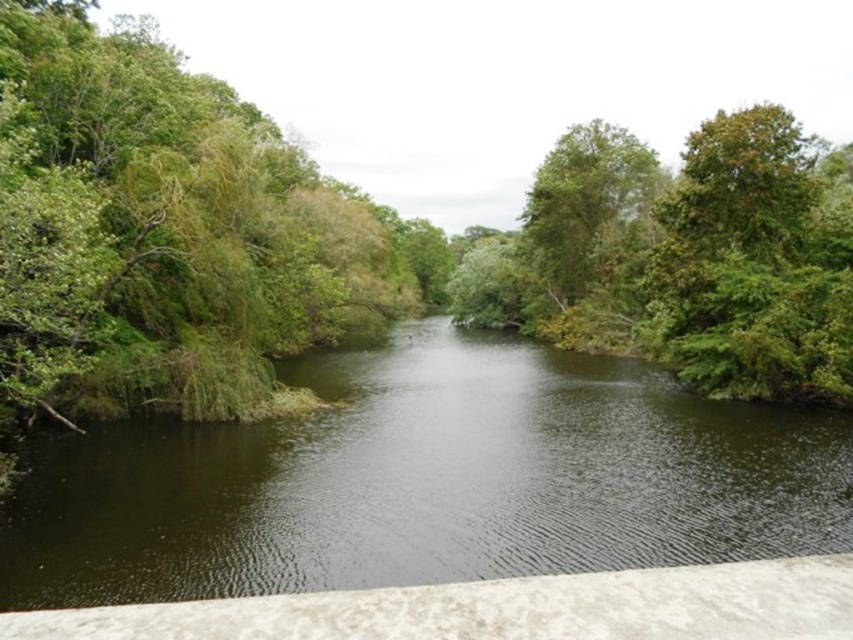
Between point (480, 540) and point (618, 269), which one is positioned behind?

Positioned behind is point (618, 269).

Who is more distant from viewer, (770, 468) or (531, 189)?

Positioned behind is point (531, 189).

Find the location of a particular element. The height and width of the screenshot is (640, 853). dark green water at center is located at coordinates (426, 481).